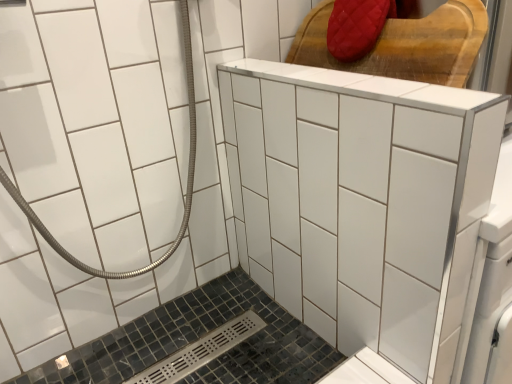
Question: Does black mosaic tile bath at lower left have a greater height compared to white glossy ceramic tile at center?

Choices:
 (A) no
 (B) yes

Answer: (A)

Question: Is black mosaic tile bath at lower left to the right of white glossy ceramic tile at center from the viewer's perspective?

Choices:
 (A) no
 (B) yes

Answer: (A)

Question: Can you see black mosaic tile bath at lower left touching white glossy ceramic tile at center?

Choices:
 (A) no
 (B) yes

Answer: (A)

Question: Is white glossy ceramic tile at center completely or partially inside black mosaic tile bath at lower left?

Choices:
 (A) yes
 (B) no

Answer: (B)

Question: Considering the relative sizes of black mosaic tile bath at lower left and white glossy ceramic tile at center in the image provided, is black mosaic tile bath at lower left smaller than white glossy ceramic tile at center?

Choices:
 (A) no
 (B) yes

Answer: (B)

Question: From the image's perspective, is black mosaic tile bath at lower left under white glossy ceramic tile at center?

Choices:
 (A) no
 (B) yes

Answer: (B)

Question: Is red quilted fabric at upper right taller than black mosaic tile bath at lower left?

Choices:
 (A) no
 (B) yes

Answer: (B)

Question: Is red quilted fabric at upper right located outside black mosaic tile bath at lower left?

Choices:
 (A) yes
 (B) no

Answer: (A)

Question: Does red quilted fabric at upper right lie in front of black mosaic tile bath at lower left?

Choices:
 (A) yes
 (B) no

Answer: (B)

Question: Is red quilted fabric at upper right positioned behind black mosaic tile bath at lower left?

Choices:
 (A) no
 (B) yes

Answer: (B)

Question: Is red quilted fabric at upper right beside black mosaic tile bath at lower left?

Choices:
 (A) no
 (B) yes

Answer: (A)

Question: Is red quilted fabric at upper right oriented away from black mosaic tile bath at lower left?

Choices:
 (A) yes
 (B) no

Answer: (B)

Question: Does white glossy ceramic tile at center appear on the right side of black mosaic tile bath at lower left?

Choices:
 (A) yes
 (B) no

Answer: (A)